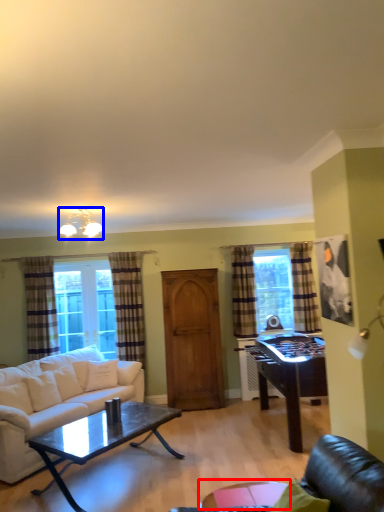
Question: Which object appears farthest to the camera in this image, glass table (highlighted by a red box) or light fixture (highlighted by a blue box)?

Choices:
 (A) glass table
 (B) light fixture

Answer: (B)